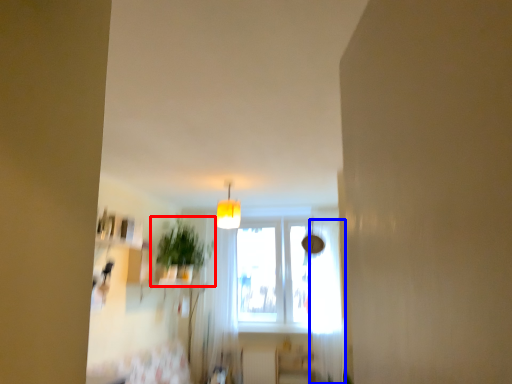
Question: Which point is further to the camera, houseplant (highlighted by a red box) or curtain (highlighted by a blue box)?

Choices:
 (A) houseplant
 (B) curtain

Answer: (B)